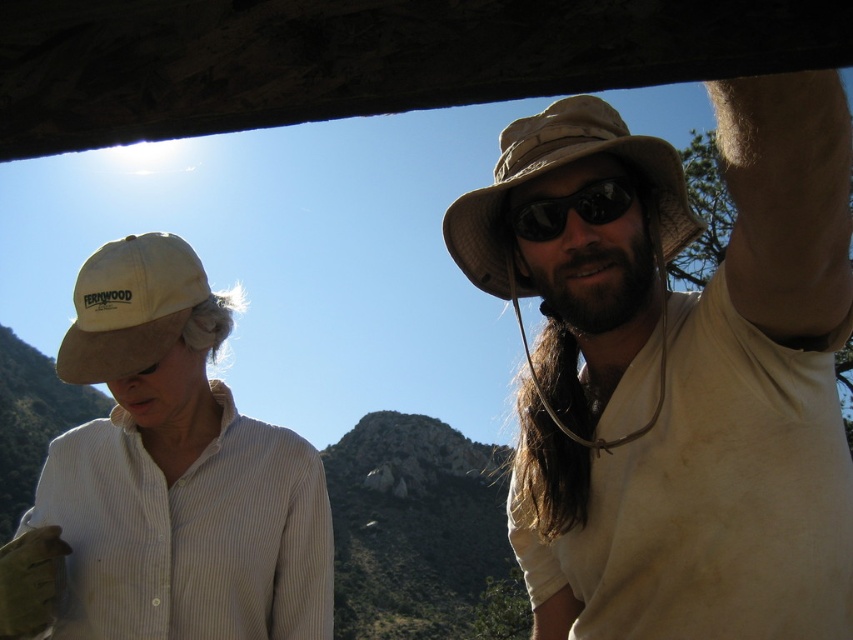
Question: Is tan fabric cowboy hat at upper right above black matte sunglasses at upper center?

Choices:
 (A) yes
 (B) no

Answer: (A)

Question: Which point is closer to the camera?

Choices:
 (A) matte khaki hat at upper right
 (B) white cotton shirt at left
 (C) tan fabric cowboy hat at upper right
 (D) black matte sunglasses at upper center

Answer: (A)

Question: Which object is farther from the camera taking this photo?

Choices:
 (A) tan fabric cowboy hat at upper right
 (B) beige fabric cowboy hat at left
 (C) white cotton shirt at left
 (D) matte khaki hat at upper right

Answer: (C)

Question: Is tan fabric cowboy hat at upper right positioned before beige fabric cowboy hat at left?

Choices:
 (A) no
 (B) yes

Answer: (B)

Question: Does white cotton shirt at left have a larger size compared to tan fabric cowboy hat at upper right?

Choices:
 (A) no
 (B) yes

Answer: (B)

Question: Which object appears closest to the camera in this image?

Choices:
 (A) white cotton shirt at left
 (B) black matte sunglasses at upper center

Answer: (A)